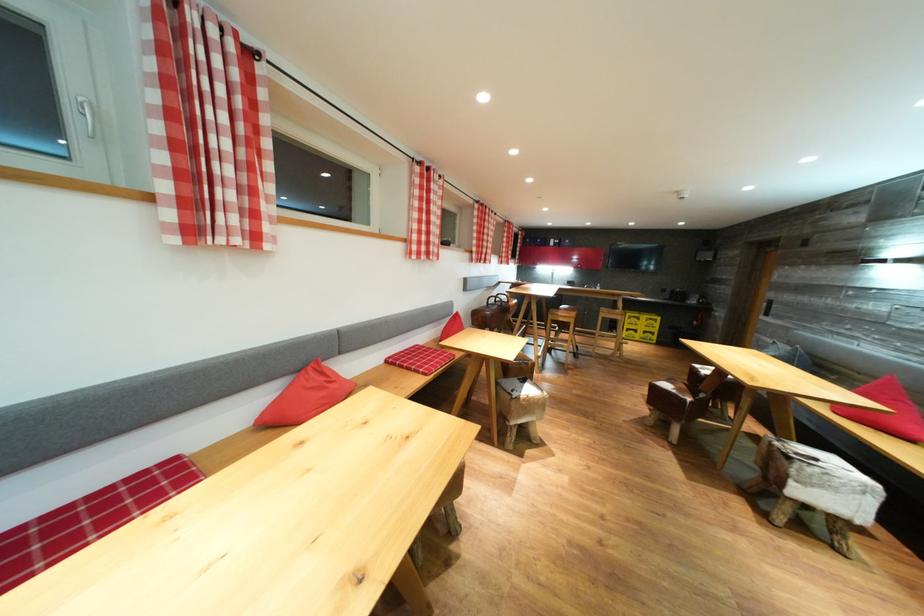
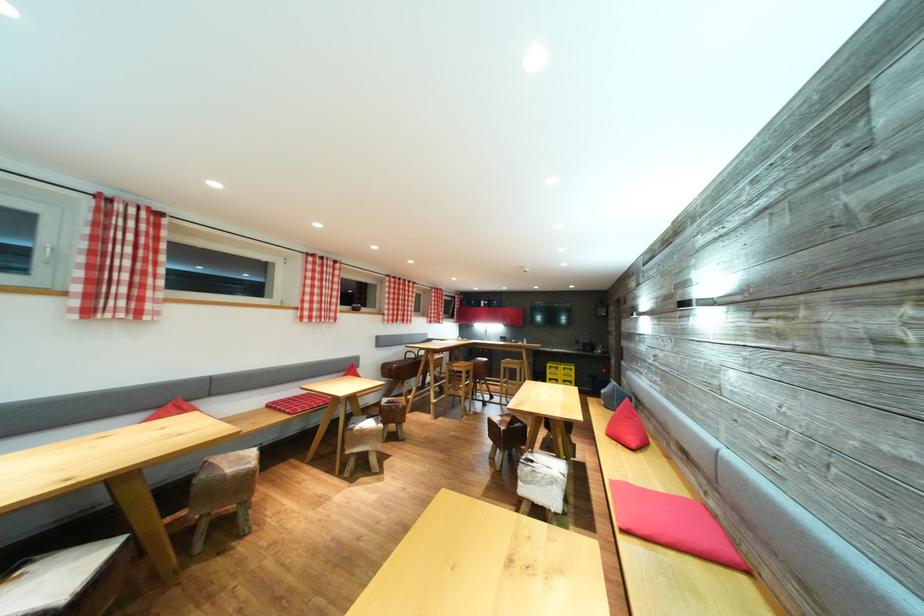
In a continuous first-person perspective shot, in which direction is the camera moving?

The cameraman walked toward right, backward.